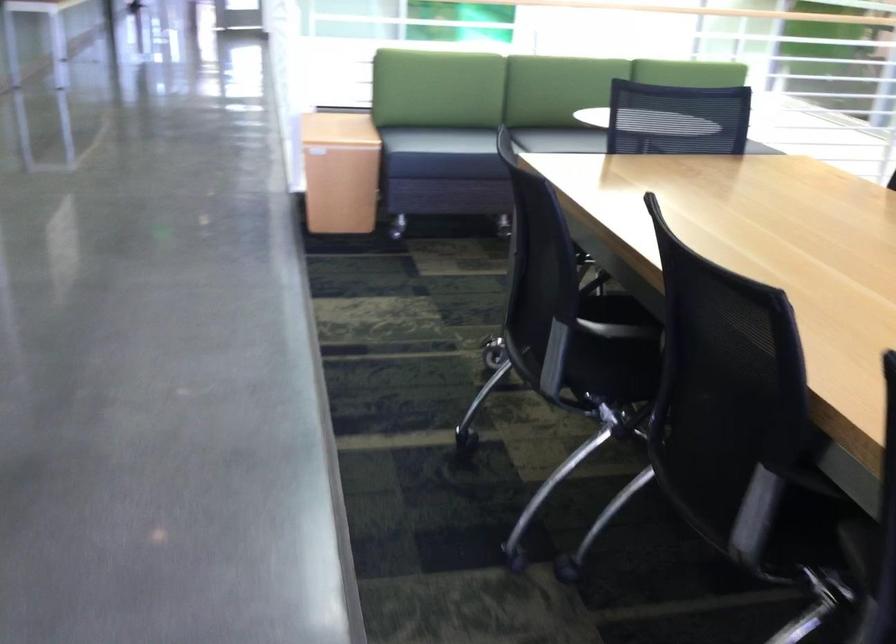
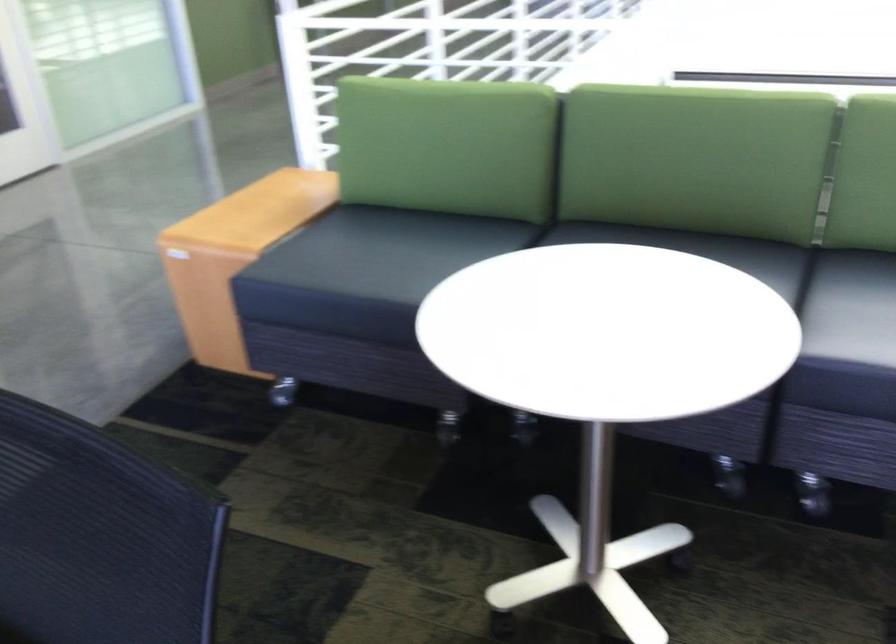
The point at [527,116] is marked in the first image. Where is the corresponding point in the second image?

(702, 250)